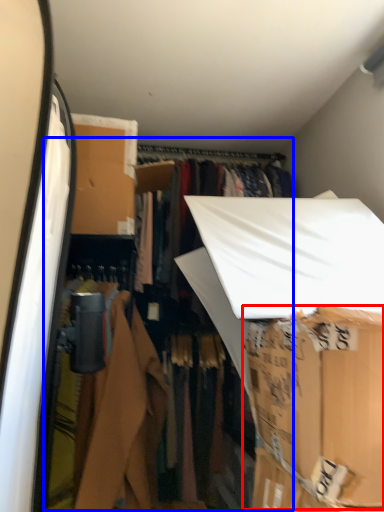
Question: Which object appears closest to the camera in this image, cardboard box (highlighted by a red box) or closet (highlighted by a blue box)?

Choices:
 (A) cardboard box
 (B) closet

Answer: (A)